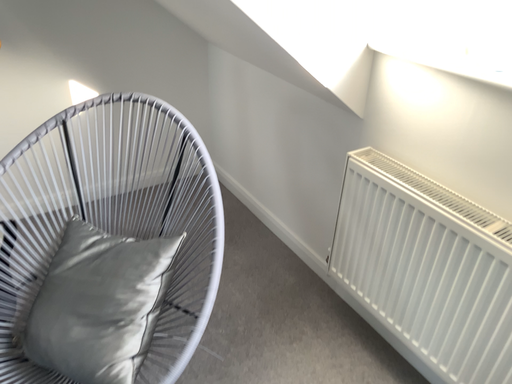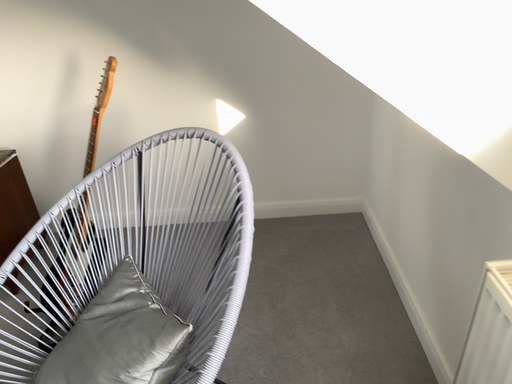
Question: Which way did the camera rotate in the video?

Choices:
 (A) rotated left
 (B) rotated right

Answer: (A)